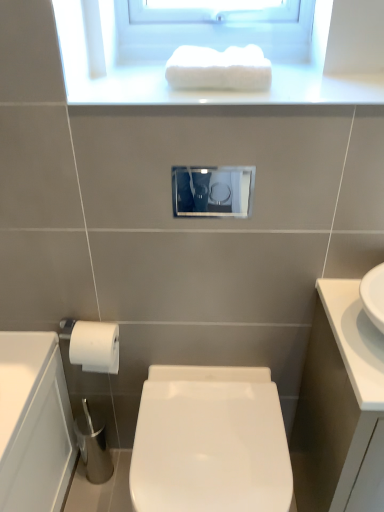
Where is `vacant space to the right of white fluffy towel at upper center`? Image resolution: width=384 pixels, height=512 pixels. vacant space to the right of white fluffy towel at upper center is located at coordinates (326, 91).